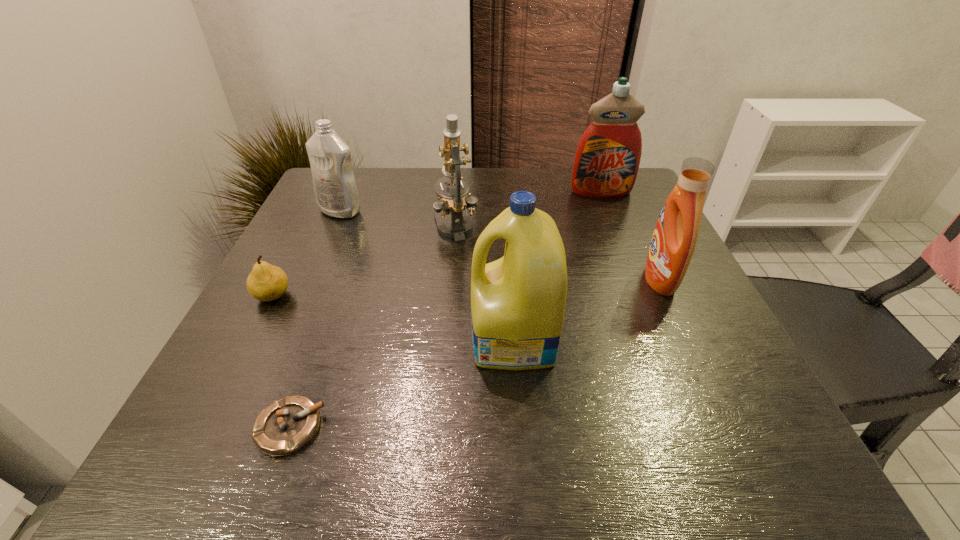
This screenshot has height=540, width=960. Identify the location of object that can be found as the sixth closest to the nearest detergent. (607, 159).

Find the location of a particular element. The height and width of the screenshot is (540, 960). object that is the sixth closest to the second farthest detergent is located at coordinates (674, 239).

At what (x,y) coordinates should I click in order to perform the action: click on the closest detergent to the third farthest detergent. Please return your answer as a coordinate pair (x, y). Looking at the image, I should click on (518, 302).

Where is `the third closest detergent to the second shortest object`? The height and width of the screenshot is (540, 960). the third closest detergent to the second shortest object is located at coordinates (607, 159).

Locate an element on the screen. The image size is (960, 540). vacant point that satisfies the following two spatial constraints: 1. on the front side of the nearest object; 2. on the right side of the leftmost detergent is located at coordinates (246, 427).

This screenshot has height=540, width=960. I want to click on free space in the image that satisfies the following two spatial constraints: 1. on the front side of the microscope; 2. on the left side of the second farthest detergent, so click(x=333, y=228).